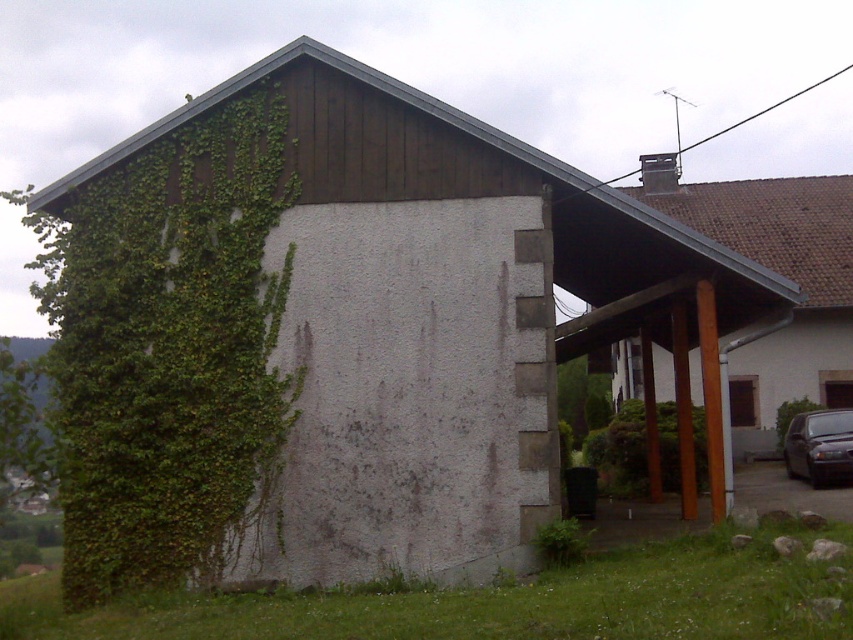
You are a painter who needs to cover both the green ivy at upper left and the brown wood carport at upper right with paint. Which object requires more paint based on their widths?

The brown wood carport at upper right requires more paint because its width is greater than the green ivy at upper left.

You are a gardener assessing the growth of plants on a building wall. You notice the green ivy at upper left and the metallic gray sedan at lower right. Which object takes up more space in the scene?

The green ivy at upper left takes up more space in the scene than the metallic gray sedan at lower right.

You are standing at the entrance of the building and want to walk towards the point labeled as point (827, 449). Will the point labeled as point (757, 364) block your path?

Point (757, 364) is behind point (827, 449), so it will not block your path when walking towards point (827, 449) from the entrance.